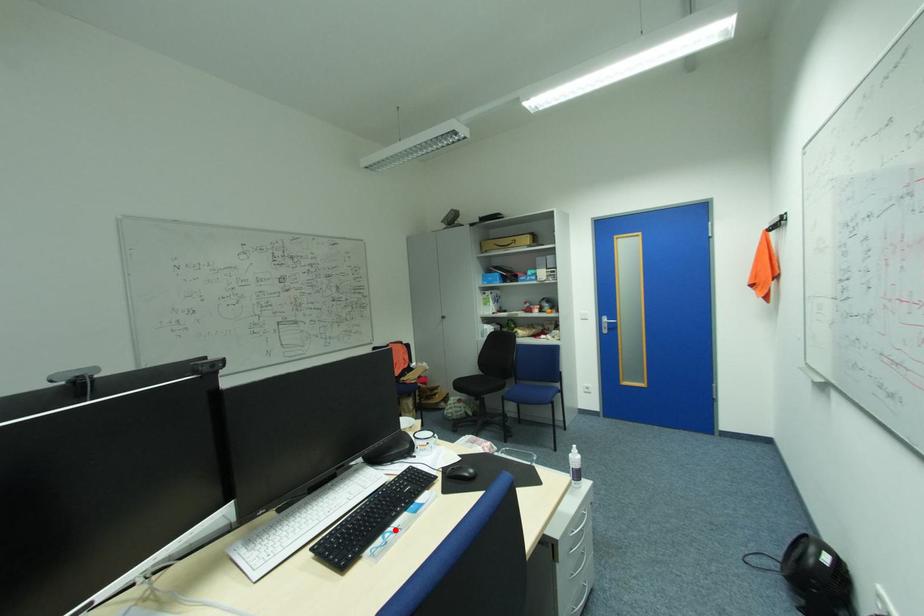
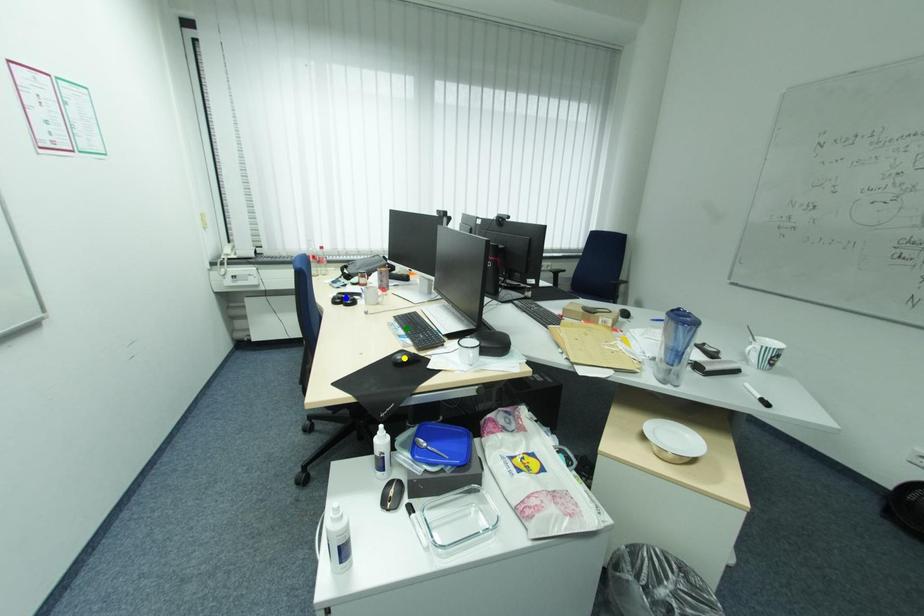
Question: I am providing you with two images of the same scene from different viewpoints. A red point is marked on the first image. You are given multiple points on the second image. Which point in image 2 represents the same 3d spot as the red point in image 1?

Choices:
 (A) green point
 (B) blue point
 (C) yellow point

Answer: (A)